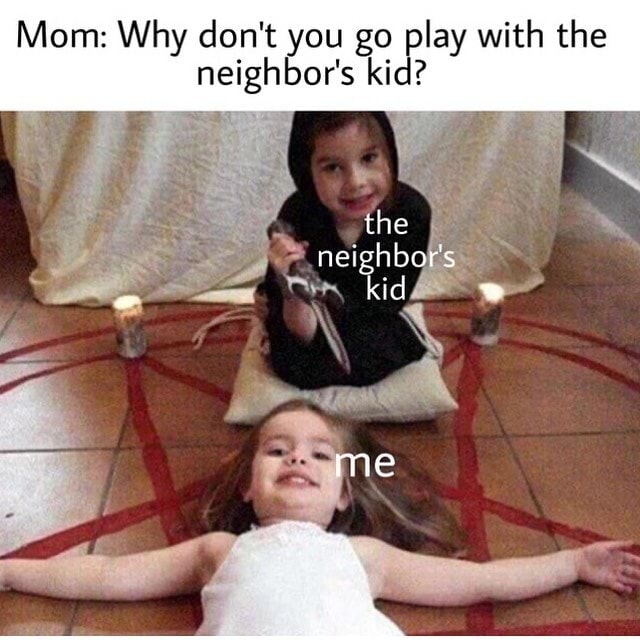
The width and height of the screenshot is (640, 640). What are the coordinates of `candle` in the screenshot? It's located at (128, 333).